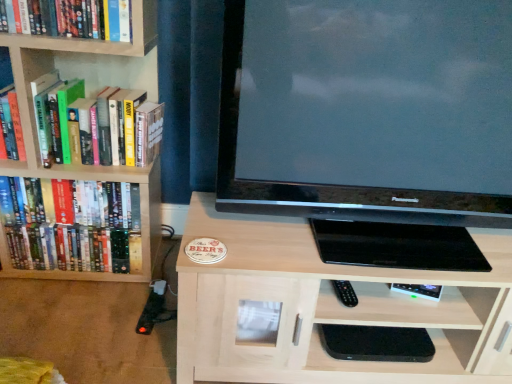
Question: Considering the relative sizes of hardcover book at upper left, placed as the 3th book when sorted from bottom to top, and hardcover books at left, which is counted as the second book, starting from the bottom, in the image provided, is hardcover book at upper left, placed as the 3th book when sorted from bottom to top, smaller than hardcover books at left, which is counted as the second book, starting from the bottom,?

Choices:
 (A) yes
 (B) no

Answer: (A)

Question: Is hardcover book at upper left, positioned as the first book in top-to-bottom order, further to camera compared to hardcover books at left, which is counted as the second book, starting from the bottom?

Choices:
 (A) no
 (B) yes

Answer: (A)

Question: Considering the relative sizes of hardcover book at upper left, positioned as the first book in top-to-bottom order, and hardcover books at left, which is counted as the second book, starting from the bottom, in the image provided, is hardcover book at upper left, positioned as the first book in top-to-bottom order, wider than hardcover books at left, which is counted as the second book, starting from the bottom,?

Choices:
 (A) yes
 (B) no

Answer: (B)

Question: Is hardcover books at left, which ranks as the 2th book in top-to-bottom order, at the back of hardcover book at upper left, placed as the 3th book when sorted from bottom to top?

Choices:
 (A) no
 (B) yes

Answer: (A)

Question: Is hardcover book at upper left, positioned as the first book in top-to-bottom order, shorter than hardcover books at left, which ranks as the 2th book in top-to-bottom order?

Choices:
 (A) no
 (B) yes

Answer: (B)

Question: Is hardcover book at upper left, placed as the 3th book when sorted from bottom to top, oriented towards hardcover books at left, which is counted as the second book, starting from the bottom?

Choices:
 (A) no
 (B) yes

Answer: (A)

Question: Does hardcover book at upper left, positioned as the first book in top-to-bottom order, have a larger size compared to hardcover books at left, the 3th book when ordered from top to bottom?

Choices:
 (A) yes
 (B) no

Answer: (B)

Question: Can you confirm if hardcover book at upper left, placed as the 3th book when sorted from bottom to top, is positioned to the right of hardcover books at left, positioned as the first book in bottom-to-top order?

Choices:
 (A) no
 (B) yes

Answer: (B)

Question: From a real-world perspective, is hardcover book at upper left, placed as the 3th book when sorted from bottom to top, physically above hardcover books at left, the 3th book when ordered from top to bottom?

Choices:
 (A) no
 (B) yes

Answer: (B)

Question: Is hardcover book at upper left, positioned as the first book in top-to-bottom order, smaller than hardcover books at left, the 3th book when ordered from top to bottom?

Choices:
 (A) no
 (B) yes

Answer: (B)

Question: Is hardcover book at upper left, placed as the 3th book when sorted from bottom to top, closer to the viewer compared to hardcover books at left, positioned as the first book in bottom-to-top order?

Choices:
 (A) yes
 (B) no

Answer: (A)

Question: Does hardcover book at upper left, placed as the 3th book when sorted from bottom to top, contain hardcover books at left, the 3th book when ordered from top to bottom?

Choices:
 (A) yes
 (B) no

Answer: (B)

Question: Is light wood cabinet at center shorter than matte black television at center?

Choices:
 (A) no
 (B) yes

Answer: (B)